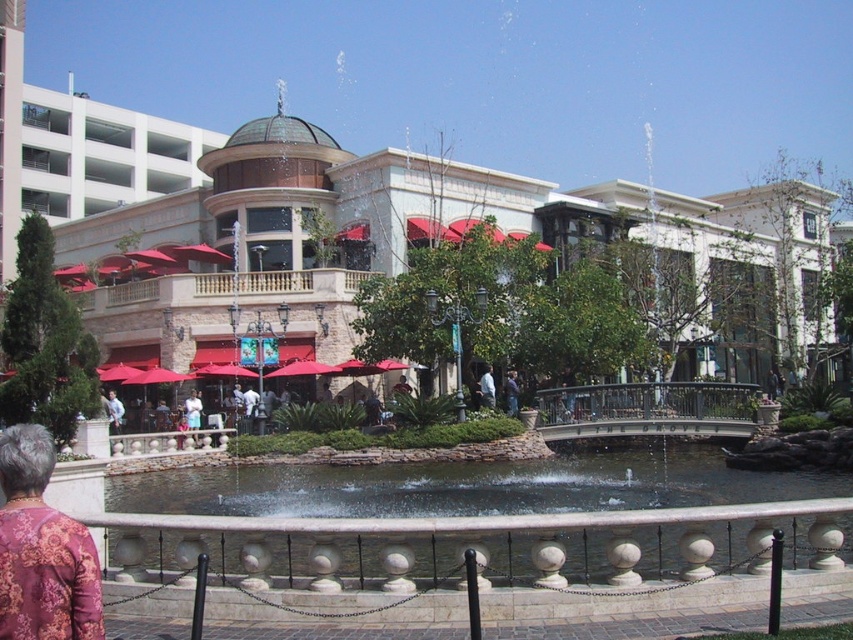
Is white fabric person at center wider than blue denim jeans at center?

In fact, white fabric person at center might be narrower than blue denim jeans at center.

Locate an element on the screen. The height and width of the screenshot is (640, 853). white fabric person at center is located at coordinates (486, 388).

Describe the element at coordinates (486, 388) in the screenshot. I see `white fabric person at center` at that location.

The height and width of the screenshot is (640, 853). What are the coordinates of `white fabric person at center` in the screenshot? It's located at (486, 388).

Is point (51, 604) positioned after point (480, 392)?

No.

Describe the element at coordinates (42, 548) in the screenshot. This screenshot has width=853, height=640. I see `patterned fabric jacket at lower left` at that location.

Is point (27, 444) behind point (483, 401)?

No, it is in front of (483, 401).

The width and height of the screenshot is (853, 640). I want to click on patterned fabric jacket at lower left, so click(42, 548).

How distant is clear glass pond at center from light blue fabric shirt at center?

clear glass pond at center and light blue fabric shirt at center are 32.07 meters apart.

Who is positioned more to the right, clear glass pond at center or light blue fabric shirt at center?

From the viewer's perspective, clear glass pond at center appears more on the right side.

Identify the location of clear glass pond at center. (482, 545).